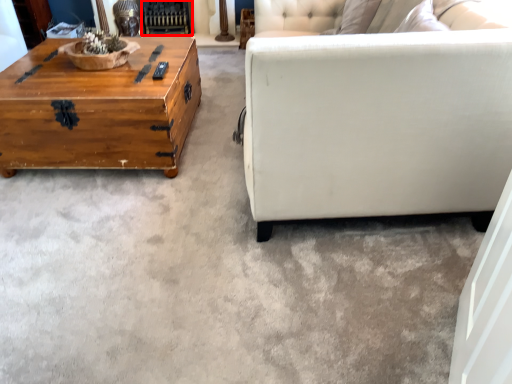
Question: From the image's perspective, considering the relative positions of fireplace (annotated by the red box) and coffee table in the image provided, where is fireplace (annotated by the red box) located with respect to the staircase?

Choices:
 (A) above
 (B) below

Answer: (A)